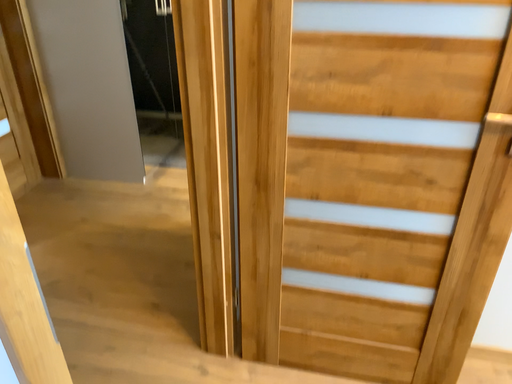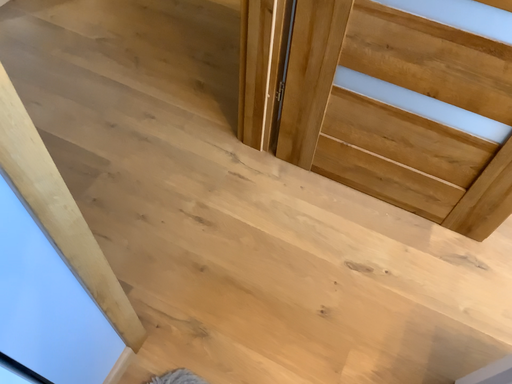
Question: How did the camera likely rotate when shooting the video?

Choices:
 (A) rotated downward
 (B) rotated upward

Answer: (A)